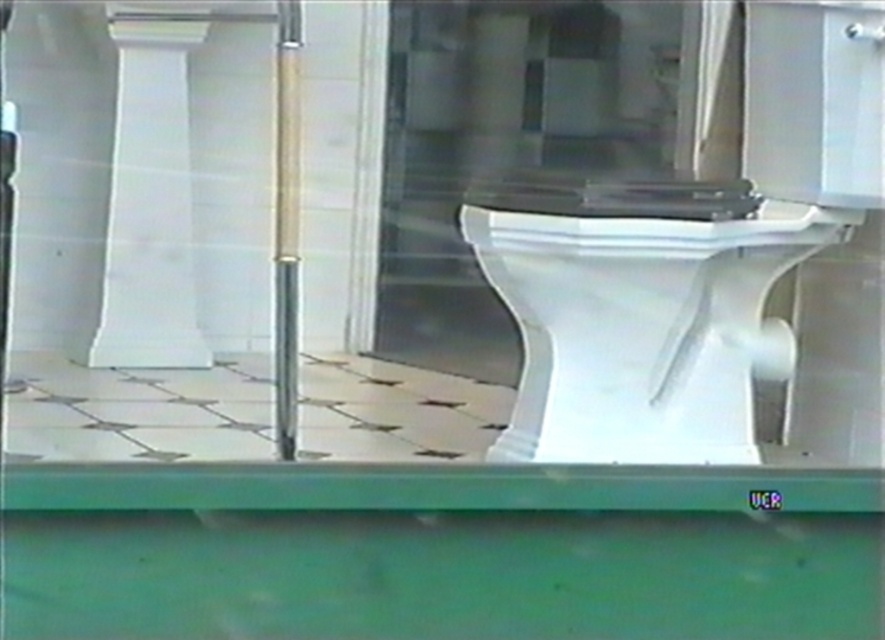
Can you confirm if transparent glass door at center is smaller than white glossy pillar at upper left?

No.

Who is more forward, (413, 160) or (113, 38)?

Point (113, 38)

Is point (420, 3) positioned behind point (127, 240)?

Yes, point (420, 3) is behind point (127, 240).

This screenshot has height=640, width=885. Identify the location of transparent glass door at center. (505, 148).

Which is above, white glossy toilet bowl at center or transparent glass door at center?

transparent glass door at center is higher up.

Can you confirm if white glossy toilet bowl at center is positioned to the left of transparent glass door at center?

Incorrect, white glossy toilet bowl at center is not on the left side of transparent glass door at center.

Find the location of a particular element. The width and height of the screenshot is (885, 640). white glossy toilet bowl at center is located at coordinates (641, 310).

Find the location of a particular element. The image size is (885, 640). white glossy toilet bowl at center is located at coordinates (641, 310).

Is point (540, 209) in front of point (181, 364)?

Yes, point (540, 209) is closer to viewer.

In the scene shown: How much distance is there between white glossy toilet bowl at center and white glossy pillar at upper left?

7.24 feet

Is point (612, 285) farther from viewer compared to point (186, 339)?

That is False.

This screenshot has height=640, width=885. In order to click on white glossy toilet bowl at center in this screenshot , I will do tap(641, 310).